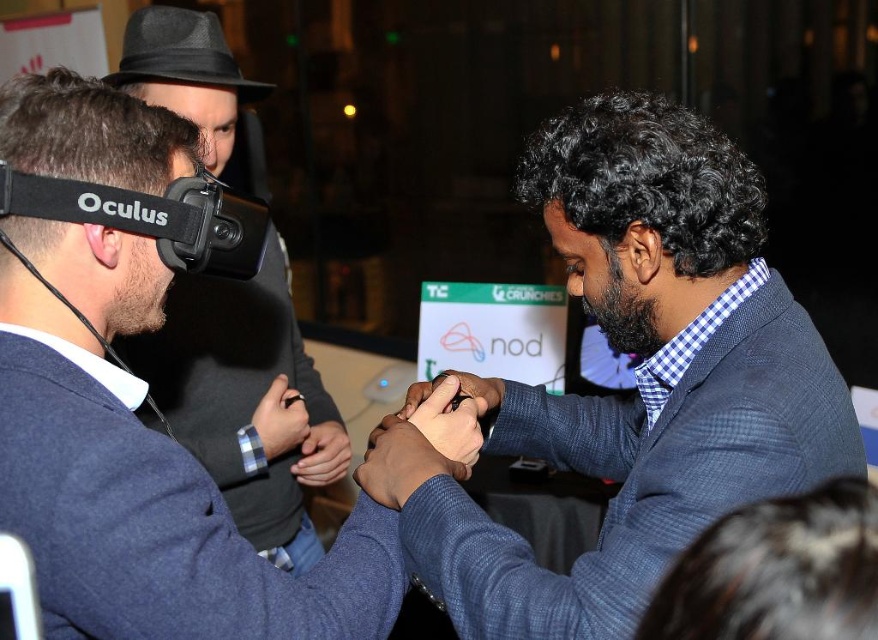
Does matte black vr headset at left appear over dark gray felt fedora at upper left?

Actually, matte black vr headset at left is below dark gray felt fedora at upper left.

Which is behind, point (319, 378) or point (238, 88)?

The point (319, 378) is behind.

Where is `matte black vr headset at left`? matte black vr headset at left is located at coordinates (243, 400).

Where is `matte black vr headset at left`? The width and height of the screenshot is (878, 640). matte black vr headset at left is located at coordinates (243, 400).

What do you see at coordinates (637, 380) in the screenshot? The height and width of the screenshot is (640, 878). I see `blue textured suit at center` at bounding box center [637, 380].

Which is below, blue textured suit at center or matte black vr headset at left?

blue textured suit at center

Does point (772, 436) come closer to viewer compared to point (240, 477)?

Yes, point (772, 436) is in front of point (240, 477).

The height and width of the screenshot is (640, 878). What are the coordinates of `blue textured suit at center` in the screenshot? It's located at (637, 380).

Can you confirm if blue sweater at center is positioned to the right of dark gray felt fedora at upper left?

Correct, you'll find blue sweater at center to the right of dark gray felt fedora at upper left.

Who is more forward, (307,596) or (199,45)?

Point (307,596) is in front.

Does point (96, 552) come closer to viewer compared to point (227, 88)?

That is True.

At what (x,y) coordinates should I click in order to perform the action: click on blue sweater at center. Please return your answer as a coordinate pair (x, y). This screenshot has width=878, height=640. Looking at the image, I should click on (141, 472).